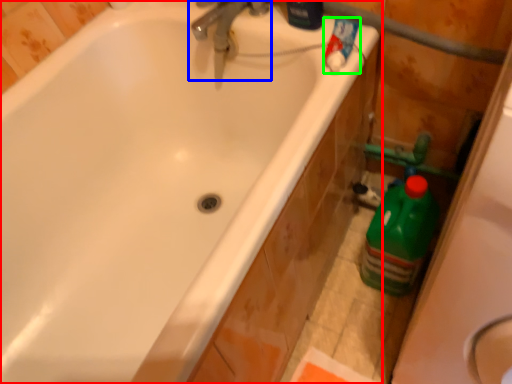
Question: Which object is positioned farthest from bathtub (highlighted by a red box)? Select from tap (highlighted by a blue box) and cleaning product (highlighted by a green box).

Choices:
 (A) tap
 (B) cleaning product

Answer: (B)